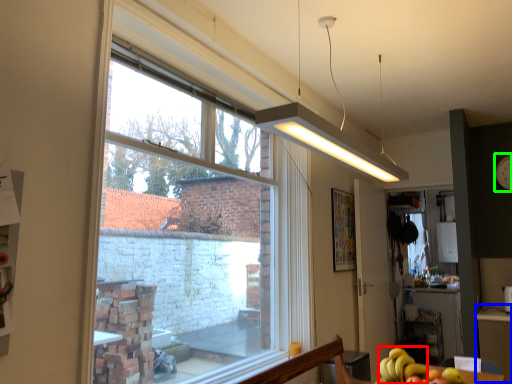
Question: Estimate the real-world distances between objects in this image. Which object is farther from banana (highlighted by a red box), table (highlighted by a blue box) or clock (highlighted by a green box)?

Choices:
 (A) table
 (B) clock

Answer: (B)